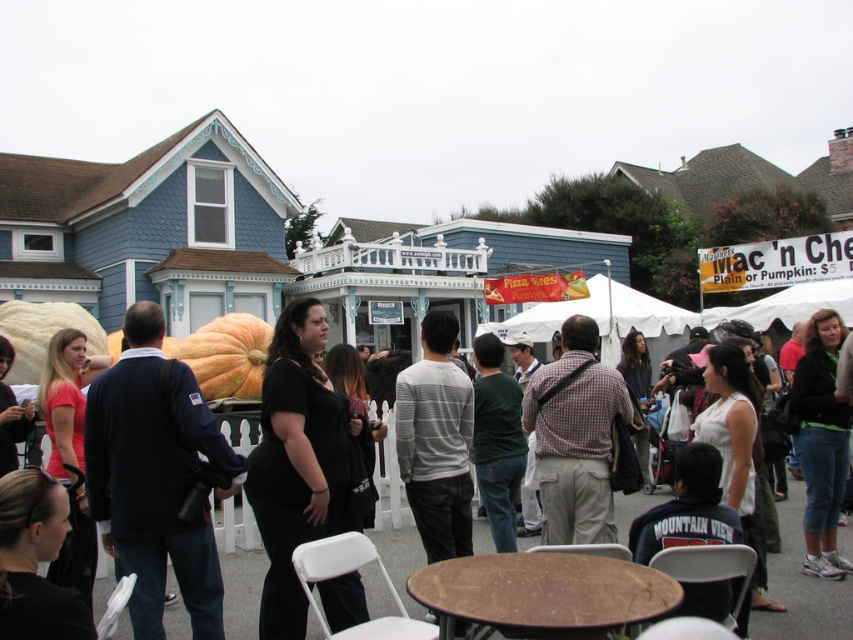
Is black dress at center positioned at the back of orange matte pumpkin at center?

That is False.

Find the location of a particular element. The width and height of the screenshot is (853, 640). black dress at center is located at coordinates (801, 588).

Is point (413, 534) closer to viewer compared to point (219, 346)?

Yes, it is.

Locate an element on the screen. The image size is (853, 640). black dress at center is located at coordinates (801, 588).